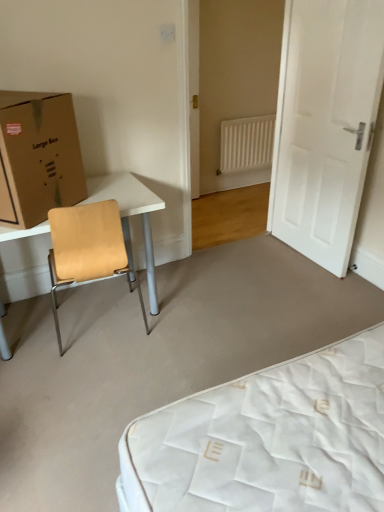
Identify the location of free spot to the left of white matte door at right. (254, 262).